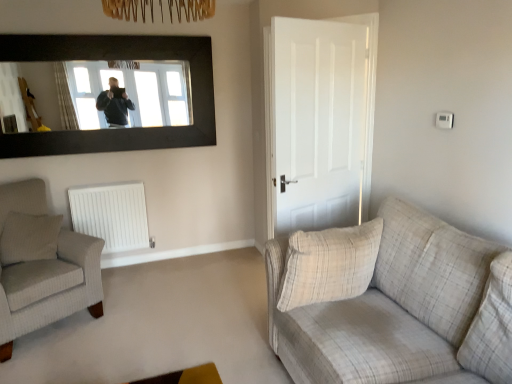
Question: Considering the relative positions of plaid fabric couch at right and light gray fabric armchair at left in the image provided, is plaid fabric couch at right to the left or to the right of light gray fabric armchair at left?

Choices:
 (A) left
 (B) right

Answer: (B)

Question: Is plaid fabric couch at right taller or shorter than light gray fabric armchair at left?

Choices:
 (A) tall
 (B) short

Answer: (A)

Question: Which of these objects is positioned closest to the light gray fabric armchair at left?

Choices:
 (A) white matte door at center
 (B) beige textured pillow at left, which is the 2th pillow in front-to-back order
 (C) white matte radiator at lower left
 (D) beige plaid pillow at right, the first pillow viewed from the front
 (E) plaid fabric couch at right

Answer: (B)

Question: Which object is positioned farthest from the plaid fabric couch at right?

Choices:
 (A) light gray fabric armchair at left
 (B) white matte radiator at lower left
 (C) beige textured pillow at left, which is the 2th pillow in front-to-back order
 (D) white matte door at center
 (E) beige plaid pillow at right, arranged as the 1th pillow when viewed from the right

Answer: (B)